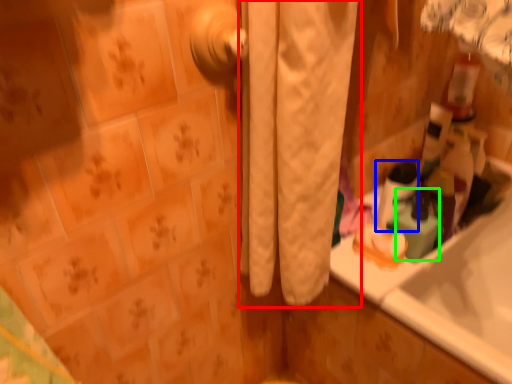
Question: Based on their relative distances, which object is nearer to curtain (highlighted by a red box)? Choose from mouthwash (highlighted by a blue box) and cleaning product (highlighted by a green box).

Choices:
 (A) mouthwash
 (B) cleaning product

Answer: (A)